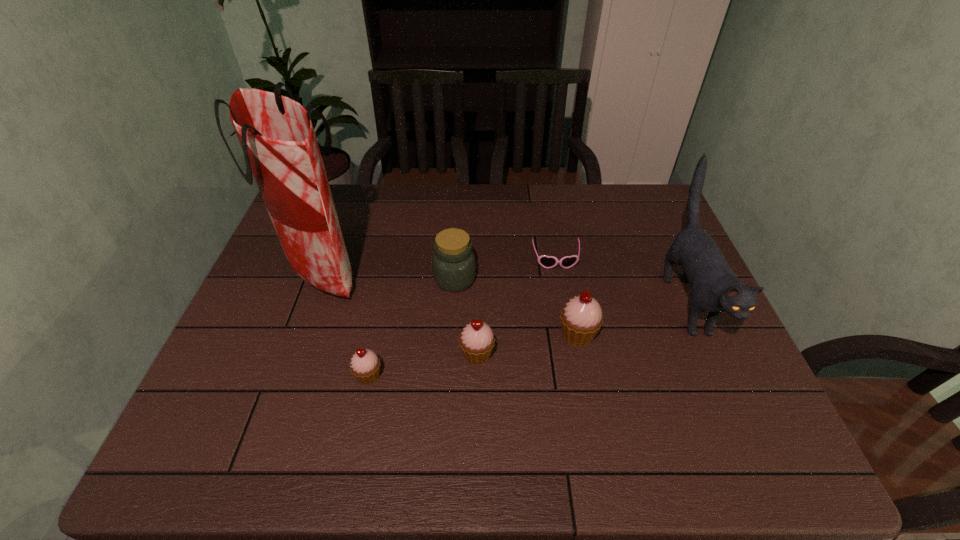
Locate an element on the screen. Image resolution: width=960 pixels, height=540 pixels. the shortest object is located at coordinates (545, 261).

This screenshot has height=540, width=960. I want to click on vacant space located 0.090m on the left of the leftmost cupcake, so click(314, 376).

Locate an element on the screen. The width and height of the screenshot is (960, 540). free space located 0.270m on the left of the third shortest object is located at coordinates (346, 355).

This screenshot has height=540, width=960. I want to click on vacant space located on the right of the rightmost cupcake, so click(x=690, y=335).

You are a GUI agent. You are given a task and a screenshot of the screen. Output one action in this format:
    pyautogui.click(x=<x>, y=<y>)
    Task: Click on the free region located at the face of the rightmost object
    The width and height of the screenshot is (960, 540).
    Given the screenshot: What is the action you would take?
    pyautogui.click(x=727, y=392)

At what (x,y) coordinates should I click in order to perform the action: click on vacant region located 0.190m on the front of the jar. Please return your answer as a coordinate pair (x, y). Image resolution: width=960 pixels, height=540 pixels. Looking at the image, I should click on (450, 353).

Where is `free region located 0.140m on the front of the tallest object`? free region located 0.140m on the front of the tallest object is located at coordinates (295, 349).

At what (x,y) coordinates should I click in order to perform the action: click on free location located on the front-facing side of the sunglasses. Please return your answer as a coordinate pair (x, y). The width and height of the screenshot is (960, 540). Looking at the image, I should click on [x=569, y=336].

Image resolution: width=960 pixels, height=540 pixels. In order to click on object at the near edge in this screenshot , I will do `click(365, 365)`.

Where is `object at the left edge`? object at the left edge is located at coordinates (280, 147).